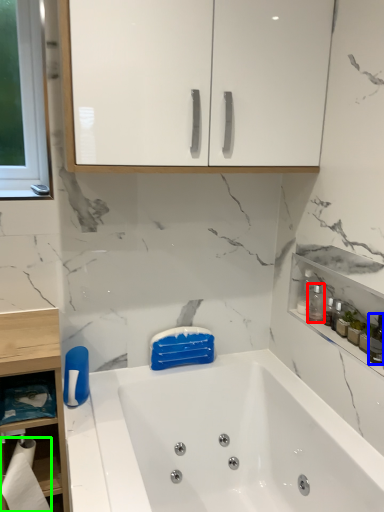
Question: Considering the real-world distances, which object is closest to cleaning product (highlighted by a red box)? toiletry (highlighted by a blue box) or toilet paper (highlighted by a green box).

Choices:
 (A) toiletry
 (B) toilet paper

Answer: (A)